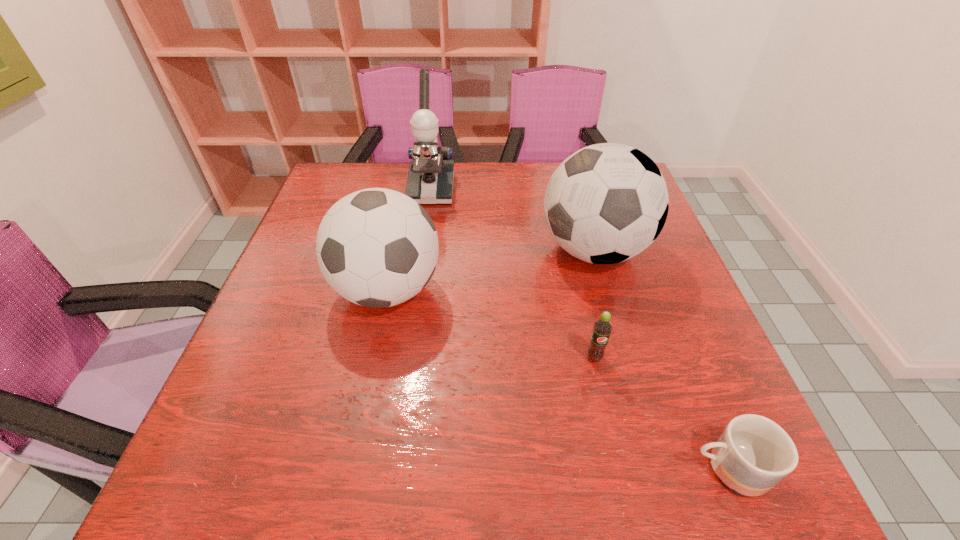
Find the location of a particular element. The height and width of the screenshot is (540, 960). the farthest object is located at coordinates (430, 180).

You are a GUI agent. You are given a task and a screenshot of the screen. Output one action in this format:
    pyautogui.click(x=<x>, y=<y>)
    Task: Click on the tallest object
    
    Given the screenshot: What is the action you would take?
    pyautogui.click(x=430, y=180)

Where is `the right soccer ball`? the right soccer ball is located at coordinates (606, 203).

Find the location of a particular element. the left soccer ball is located at coordinates (376, 247).

What are the coordinates of `the second nearest object` in the screenshot? It's located at tap(602, 327).

Where is `soda`? The width and height of the screenshot is (960, 540). soda is located at coordinates (602, 327).

The image size is (960, 540). Identify the location of the shortest object. (753, 453).

Locate an element on the screen. mug is located at coordinates point(753,453).

Find the location of a particular element. The height and width of the screenshot is (540, 960). vacant region located 0.090m at the eyepiece of the microscope is located at coordinates (425, 226).

The width and height of the screenshot is (960, 540). In order to click on free point located 0.200m on the main logo of the right soccer ball in this screenshot , I will do `click(458, 250)`.